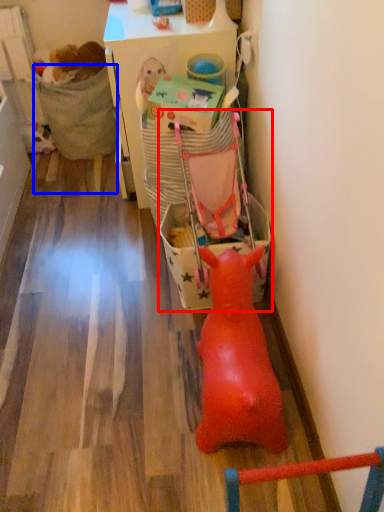
Question: Which of the following is the farthest to the observer, baby carriage (highlighted by a red box) or chair (highlighted by a blue box)?

Choices:
 (A) baby carriage
 (B) chair

Answer: (B)